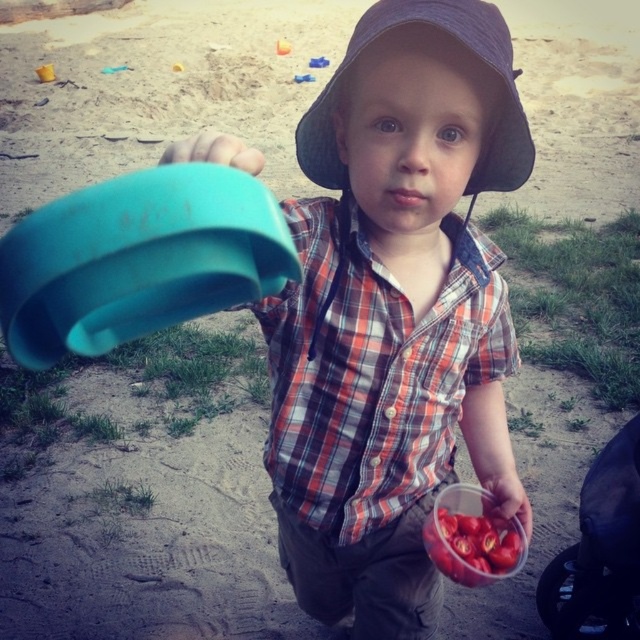
Question: Is dark blue fabric hat at center in front of teal plastic cup at upper left?

Choices:
 (A) yes
 (B) no

Answer: (B)

Question: Which object is farther from the camera taking this photo?

Choices:
 (A) plaid cotton shirt at center
 (B) matte plastic bucket at upper left

Answer: (A)

Question: Which point appears farthest from the camera in this image?

Choices:
 (A) (451, 304)
 (B) (244, 164)

Answer: (A)

Question: Can you confirm if plaid cotton shirt at center is wider than dark blue fabric hat at center?

Choices:
 (A) no
 (B) yes

Answer: (B)

Question: Is matte plastic bucket at upper left positioned at the back of teal plastic cup at upper left?

Choices:
 (A) no
 (B) yes

Answer: (B)

Question: Among these points, which one is farthest from the camera?

Choices:
 (A) (488, 113)
 (B) (388, 285)

Answer: (B)